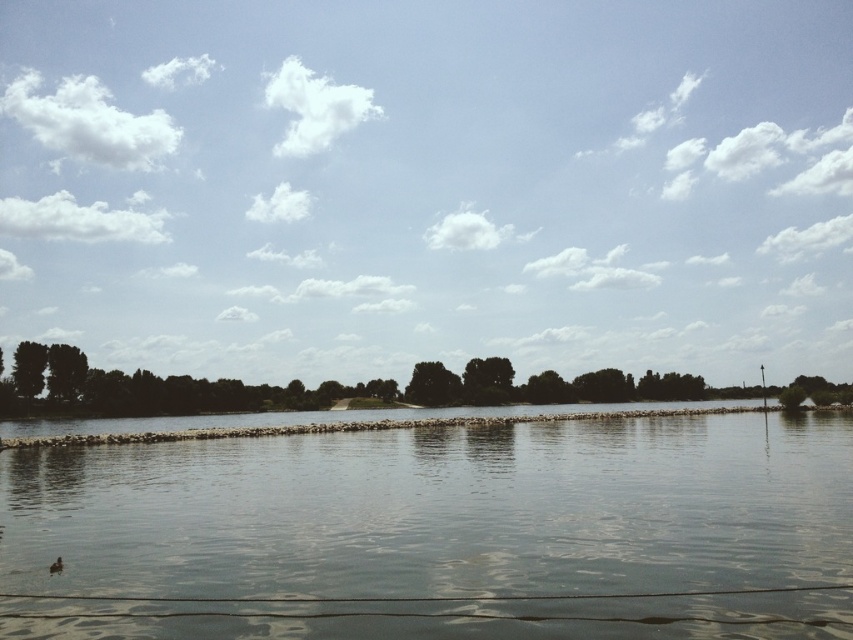
You are a photographer trying to capture the brown fuzzy duck at lower left and the gray stone river at center in the same frame. Based on their positions, which object should you focus on first to ensure both are in the shot?

The gray stone river at center is located below the brown fuzzy duck at lower left, so you should focus on the brown fuzzy duck at lower left first to ensure both are in the frame.

You are standing at the lakeside and see two points marked on the water. Which point is closer to you, point (189, 540) or point (49, 564)?

Point (49, 564) is closer to you because it is less further to the viewer than point (189, 540).

You are a photographer standing at the lakeside and want to take a photo of both the gray stone river at center and the brown fuzzy duck at lower left. Which object should you focus on first to ensure both are in sharp focus?

You should focus on the gray stone river at center first because it is closer to the viewer than the brown fuzzy duck at lower left, so adjusting focus from near to far will help both be in sharp focus.